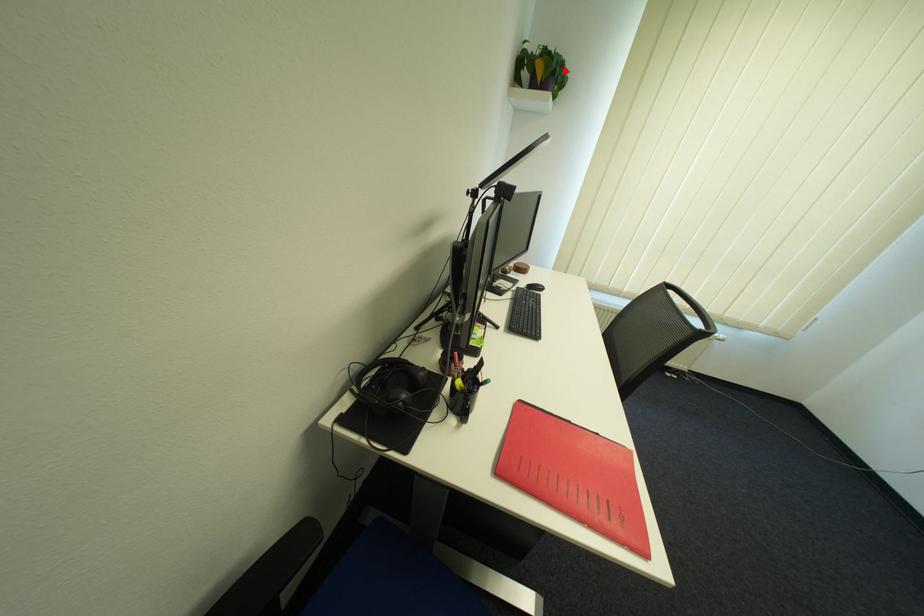
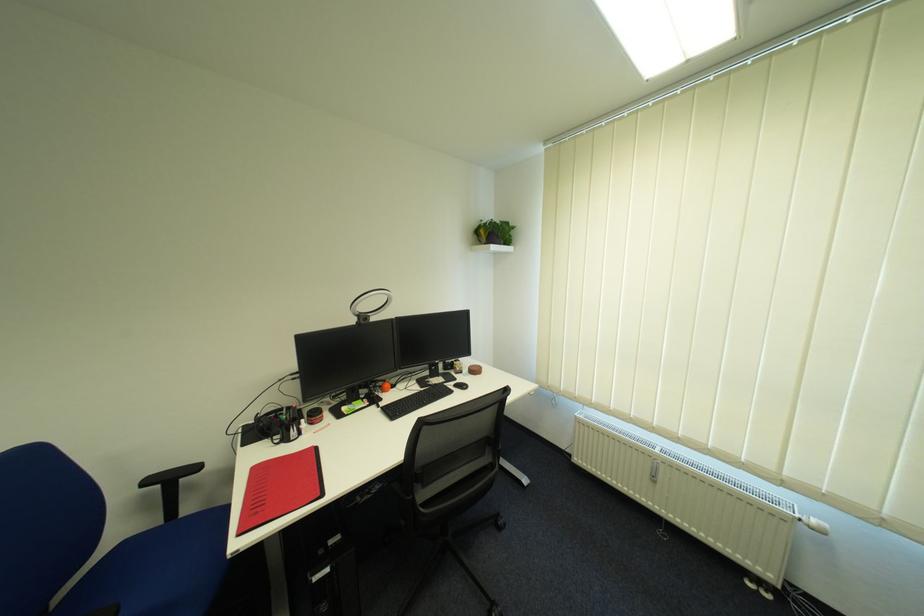
The point at the highlighted location is marked in the first image. Where is the corresponding point in the second image?

(503, 233)